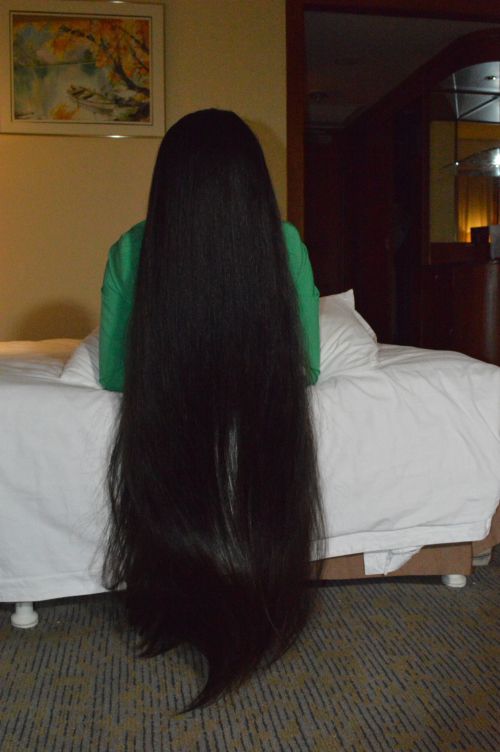
At what (x,y) coordinates should I click in order to perform the action: click on pillow. Please return your answer as a coordinate pair (x, y). This screenshot has height=752, width=500. Looking at the image, I should click on (358, 338).